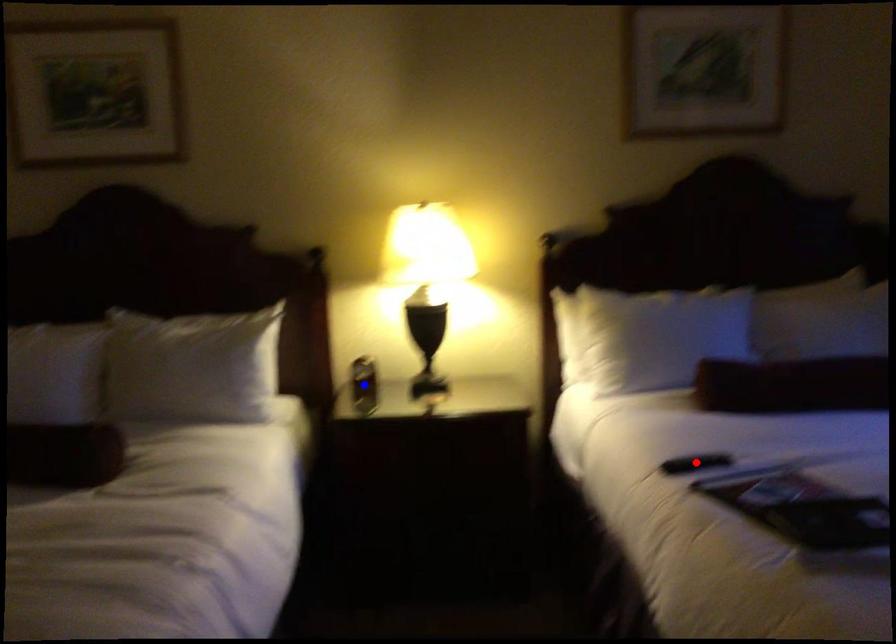
Question: In the image, two points are highlighted. Which point is nearer to the camera? Reply with the corresponding letter.

Choices:
 (A) blue point
 (B) red point

Answer: (B)